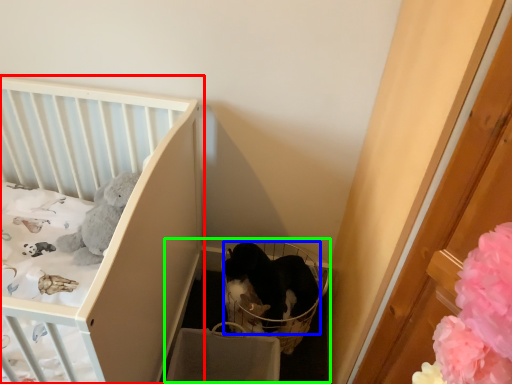
Question: Based on their relative distances, which object is farther from infant bed (highlighted by a red box)? Choose from cat (highlighted by a blue box) and baby carriage (highlighted by a green box).

Choices:
 (A) cat
 (B) baby carriage

Answer: (A)